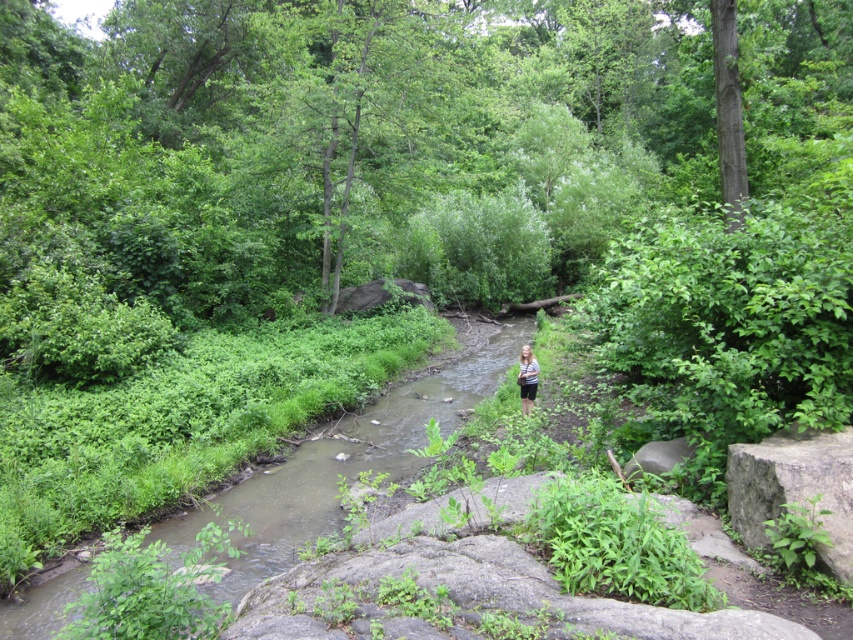
Based on the photo, between clear water stream at center and gray rough stone at lower right, which one appears on the left side from the viewer's perspective?

From the viewer's perspective, clear water stream at center appears more on the left side.

Is clear water stream at center taller than gray rough stone at lower right?

Yes, clear water stream at center is taller than gray rough stone at lower right.

Between point (12, 632) and point (776, 496), which one is positioned in front?

Point (776, 496) is more forward.

Locate an element on the screen. This screenshot has height=640, width=853. clear water stream at center is located at coordinates (355, 458).

Is clear water stream at center to the left of striped fabric shirt at center from the viewer's perspective?

Indeed, clear water stream at center is positioned on the left side of striped fabric shirt at center.

Does clear water stream at center have a greater width compared to striped fabric shirt at center?

Yes, clear water stream at center is wider than striped fabric shirt at center.

Who is more distant from viewer, [502,333] or [517,374]?

The point [502,333] is behind.

Where is `clear water stream at center`? The height and width of the screenshot is (640, 853). clear water stream at center is located at coordinates (355, 458).

Between point (838, 508) and point (531, 404), which one is positioned behind?

The point (531, 404) is behind.

Is point (846, 428) farther from camera compared to point (524, 381)?

No, it is in front of (524, 381).

What are the coordinates of `gray rough stone at lower right` in the screenshot? It's located at click(x=793, y=486).